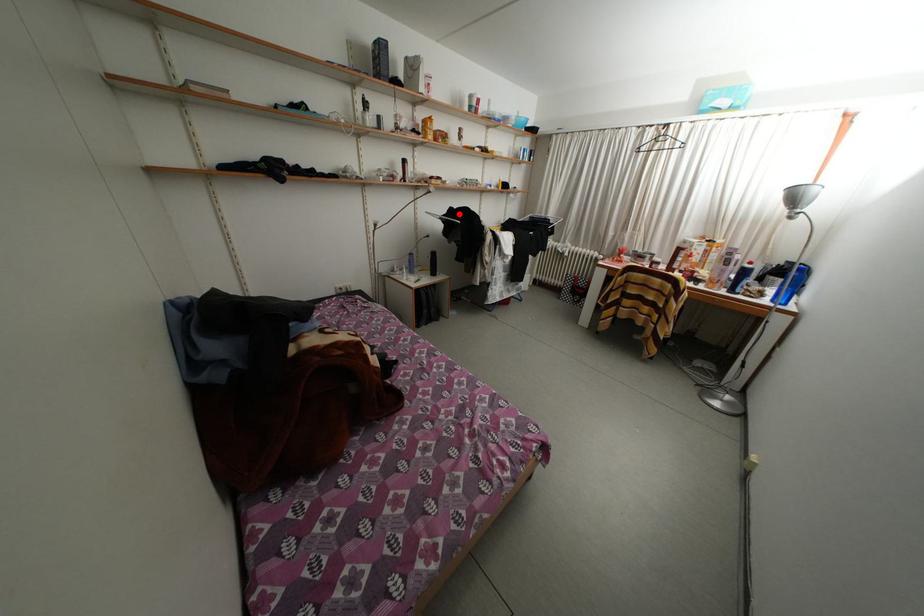
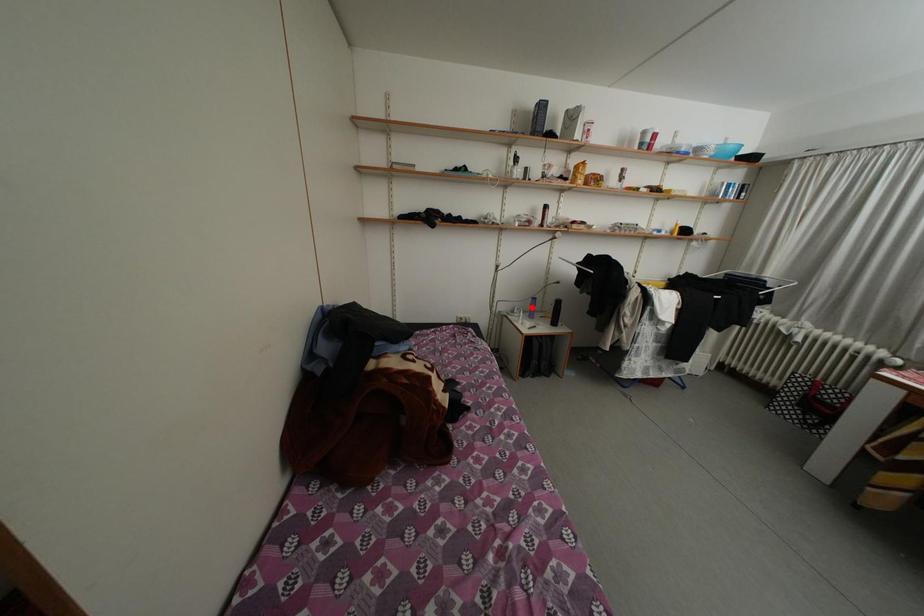
I am providing you with two images of the same scene from different viewpoints. A red point is marked on the first image and another point is marked on the second image. Do the highlighted points in image1 and image2 indicate the same real-world spot?

No